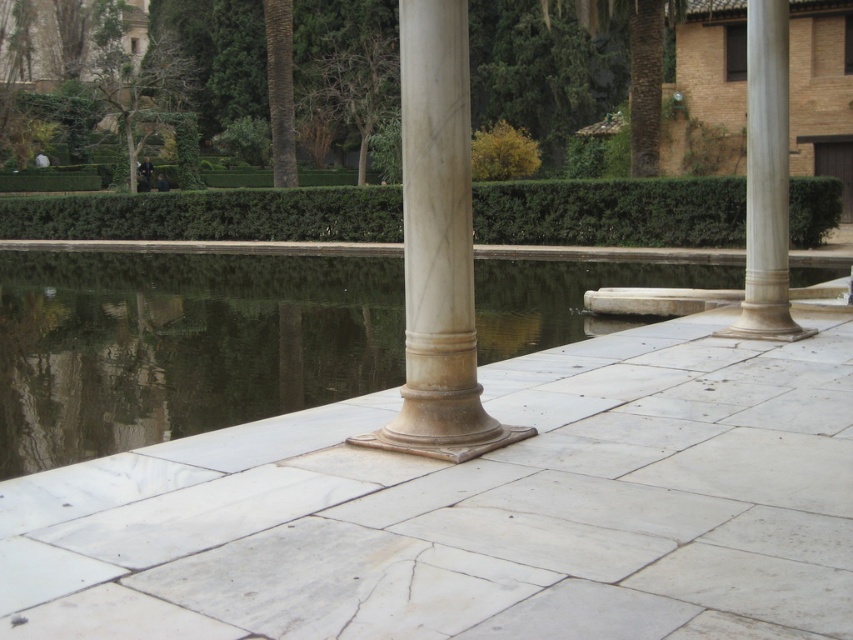
Is point (328, 349) farther from viewer compared to point (410, 102)?

Yes, point (328, 349) is behind point (410, 102).

The image size is (853, 640). I want to click on smooth stone water at center, so click(x=181, y=344).

Where is `smooth stone water at center`? This screenshot has width=853, height=640. smooth stone water at center is located at coordinates (181, 344).

In order to click on smooth stone water at center in this screenshot , I will do `click(181, 344)`.

Between smooth stone water at center and white marble column at right, which one has less height?

With less height is smooth stone water at center.

Which is above, smooth stone water at center or white marble column at right?

Positioned higher is white marble column at right.

Who is more distant from viewer, (x=51, y=456) or (x=753, y=109)?

Positioned behind is point (x=753, y=109).

Find the location of `smooth stone water at center`. smooth stone water at center is located at coordinates (181, 344).

Can you confirm if green leafy hedge at center is positioned to the right of white marble column at center?

Incorrect, green leafy hedge at center is not on the right side of white marble column at center.

Does green leafy hedge at center have a lesser width compared to white marble column at center?

Incorrect, green leafy hedge at center's width is not less than white marble column at center's.

Does point (303, 195) come in front of point (415, 336)?

No, it is behind (415, 336).

You are a GUI agent. You are given a task and a screenshot of the screen. Output one action in this format:
    pyautogui.click(x=<x>, y=<y>)
    Task: Click on the green leafy hedge at center
    This screenshot has height=640, width=853.
    Given the screenshot: What is the action you would take?
    pyautogui.click(x=212, y=216)